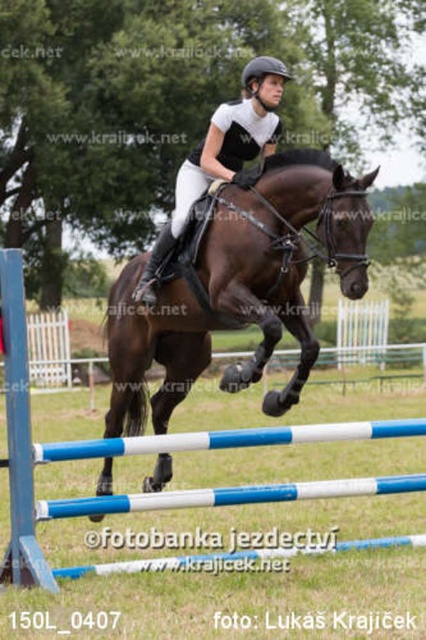
Which is in front, point (313, 204) or point (45, 561)?

Point (45, 561) is in front.

Is point (134, 278) positioned in front of point (265, 486)?

No, it is not.

Identify the location of shiny brown horse at center. The width and height of the screenshot is (426, 640). pos(238,289).